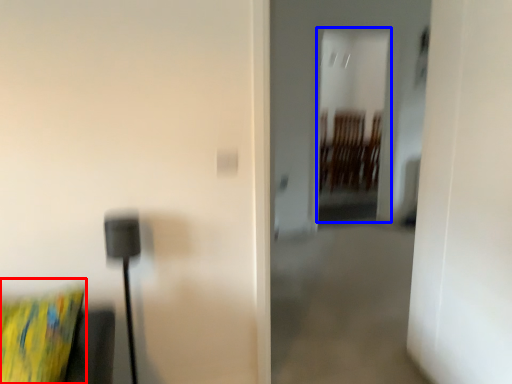
Question: Which of the following is the closest to the observer, pillow (highlighted by a red box) or glass door (highlighted by a blue box)?

Choices:
 (A) pillow
 (B) glass door

Answer: (A)